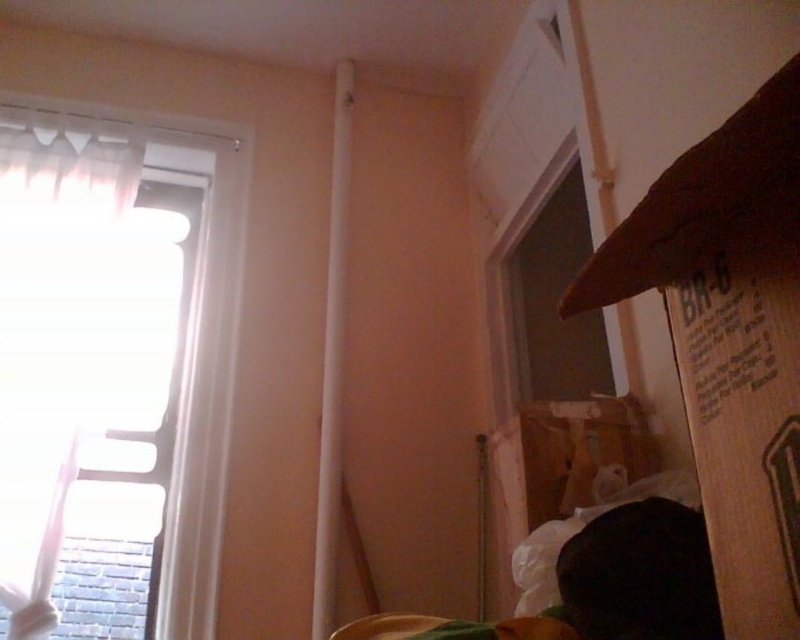
Question: Which object is closer to the camera taking this photo?

Choices:
 (A) white sheer curtain at left
 (B) brown cardboard box at lower right
 (C) brown cardboard box at right

Answer: (C)

Question: Is brown cardboard box at right smaller than white sheer curtain at left?

Choices:
 (A) yes
 (B) no

Answer: (A)

Question: Is white sheer curtain at left smaller than brown cardboard box at lower right?

Choices:
 (A) yes
 (B) no

Answer: (B)

Question: Which point is farther to the camera?

Choices:
 (A) white sheer curtain at left
 (B) brown cardboard box at right

Answer: (A)

Question: Estimate the real-world distances between objects in this image. Which object is closer to the brown cardboard box at lower right?

Choices:
 (A) white sheer curtain at left
 (B) brown cardboard box at right

Answer: (B)

Question: Is brown cardboard box at right positioned at the back of white sheer curtain at left?

Choices:
 (A) yes
 (B) no

Answer: (B)